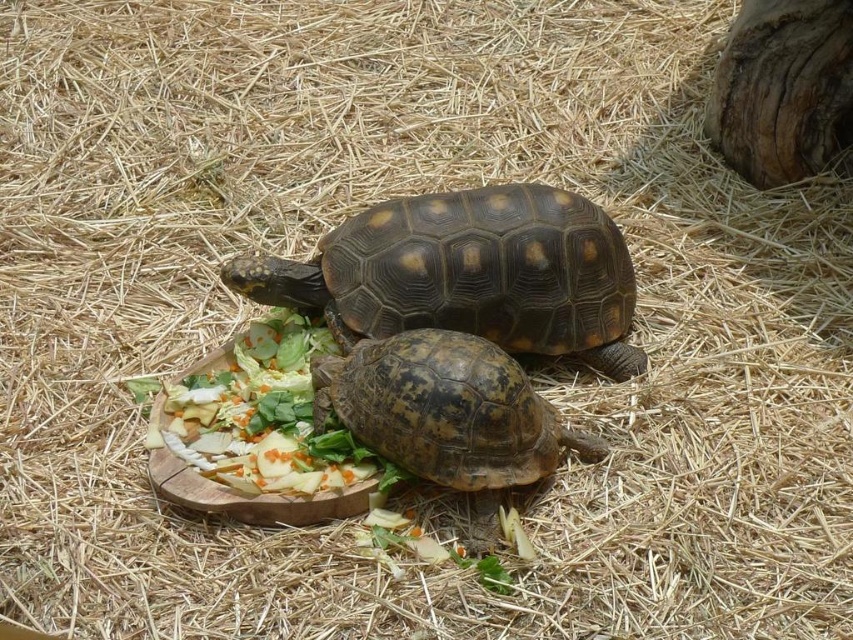
What do you see at coordinates (445, 412) in the screenshot? I see `brown rough textured tortoise at center` at bounding box center [445, 412].

Can you confirm if brown rough textured tortoise at center is smaller than fresh green salad at center?

Incorrect, brown rough textured tortoise at center is not smaller in size than fresh green salad at center.

Which is in front, point (407, 349) or point (279, 317)?

Point (407, 349) is in front.

In order to click on brown rough textured tortoise at center in this screenshot , I will do `click(445, 412)`.

Which is behind, point (601, 328) or point (576, 440)?

The point (601, 328) is more distant.

Based on the photo, between yellowish-brown textured shell at center and brown rough textured tortoise at center, which one appears on the left side from the viewer's perspective?

Positioned to the left is yellowish-brown textured shell at center.

Is point (567, 253) in front of point (401, 456)?

No, it is behind (401, 456).

Locate an element on the screen. The height and width of the screenshot is (640, 853). yellowish-brown textured shell at center is located at coordinates (468, 273).

Who is positioned more to the right, yellowish-brown textured shell at center or fresh green salad at center?

Positioned to the right is yellowish-brown textured shell at center.

Can you confirm if yellowish-brown textured shell at center is positioned below fresh green salad at center?

No.

Between point (437, 198) and point (259, 428), which one is positioned behind?

Positioned behind is point (437, 198).

At what (x,y) coordinates should I click in order to perform the action: click on yellowish-brown textured shell at center. Please return your answer as a coordinate pair (x, y). The image size is (853, 640). Looking at the image, I should click on (468, 273).